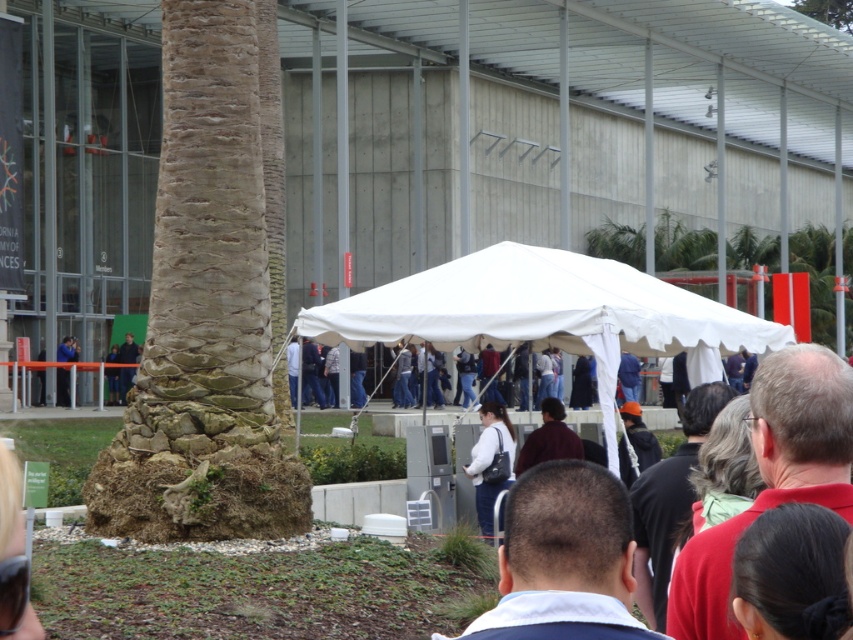
Question: Considering the relative positions of dark blue jacket at center and white matte jacket at center in the image provided, where is dark blue jacket at center located with respect to white matte jacket at center?

Choices:
 (A) right
 (B) left

Answer: (A)

Question: Which object is closer to the camera taking this photo?

Choices:
 (A) blue fabric tent at left
 (B) dark brown sweater at center
 (C) dark blue jacket at center
 (D) red shirt at center

Answer: (C)

Question: Which point is farther from the camera taking this photo?

Choices:
 (A) (483, 484)
 (B) (131, 339)
 (C) (564, 472)
 (D) (74, 360)

Answer: (D)

Question: Does red shirt at center appear on the right side of dark blue jeans at center?

Choices:
 (A) no
 (B) yes

Answer: (B)

Question: Is white fabric tent at center to the right of red shirt at center from the viewer's perspective?

Choices:
 (A) no
 (B) yes

Answer: (A)

Question: Which point is farther to the camera?

Choices:
 (A) white matte jacket at center
 (B) white fabric tent at center
 (C) dark blue jeans at center

Answer: (C)